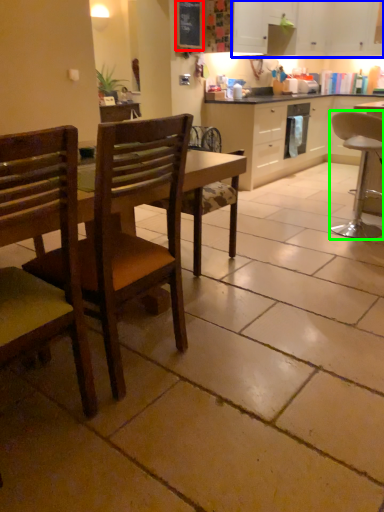
Question: Which object is positioned farthest from bulletin board (highlighted by a red box)? Select from cabinetry (highlighted by a blue box) and chair (highlighted by a green box).

Choices:
 (A) cabinetry
 (B) chair

Answer: (B)